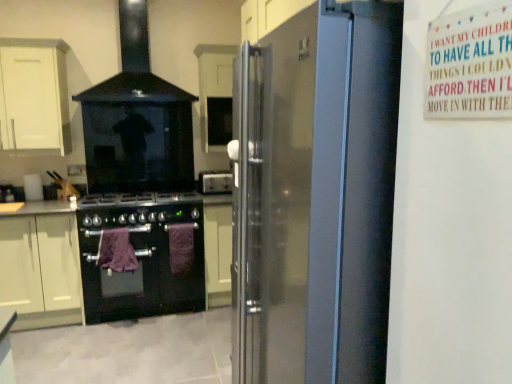
Question: Is black glass stove at center outside purple towel at center, the 1th blanket in the right-to-left sequence?

Choices:
 (A) no
 (B) yes

Answer: (B)

Question: Considering the relative positions of black glass stove at center and purple towel at center, the 1th blanket in the right-to-left sequence, in the image provided, is black glass stove at center to the left of purple towel at center, the 1th blanket in the right-to-left sequence, from the viewer's perspective?

Choices:
 (A) yes
 (B) no

Answer: (A)

Question: Can you confirm if black glass stove at center is smaller than purple towel at center, the second blanket viewed from the left?

Choices:
 (A) yes
 (B) no

Answer: (B)

Question: From the image's perspective, is black glass stove at center under purple towel at center, the 1th blanket in the right-to-left sequence?

Choices:
 (A) yes
 (B) no

Answer: (A)

Question: Is black glass stove at center closer to camera compared to purple towel at center, the 1th blanket in the right-to-left sequence?

Choices:
 (A) yes
 (B) no

Answer: (A)

Question: Can you confirm if black glass stove at center is wider than purple towel at center, the 1th blanket in the right-to-left sequence?

Choices:
 (A) no
 (B) yes

Answer: (B)

Question: Is the position of satin black refrigerator at right more distant than that of white matte cabinet at upper left, which ranks as the 2th cabinetry in right-to-left order?

Choices:
 (A) yes
 (B) no

Answer: (B)

Question: Can you confirm if satin black refrigerator at right is bigger than white matte cabinet at upper left, which ranks as the 2th cabinetry in right-to-left order?

Choices:
 (A) yes
 (B) no

Answer: (A)

Question: Is satin black refrigerator at right outside white matte cabinet at upper left, which ranks as the 2th cabinetry in right-to-left order?

Choices:
 (A) no
 (B) yes

Answer: (B)

Question: Does satin black refrigerator at right contain white matte cabinet at upper left, arranged as the second cabinetry when viewed from the left?

Choices:
 (A) no
 (B) yes

Answer: (A)

Question: Are satin black refrigerator at right and white matte cabinet at upper left, which ranks as the 2th cabinetry in right-to-left order, far apart?

Choices:
 (A) no
 (B) yes

Answer: (B)

Question: Is the position of satin black refrigerator at right less distant than that of white matte cabinet at upper left, which ranks as the 2th cabinetry in right-to-left order?

Choices:
 (A) no
 (B) yes

Answer: (B)

Question: Does black glass stove at upper center have a greater height compared to white matte cabinet at center, which is the first cabinetry from right to left?

Choices:
 (A) yes
 (B) no

Answer: (A)